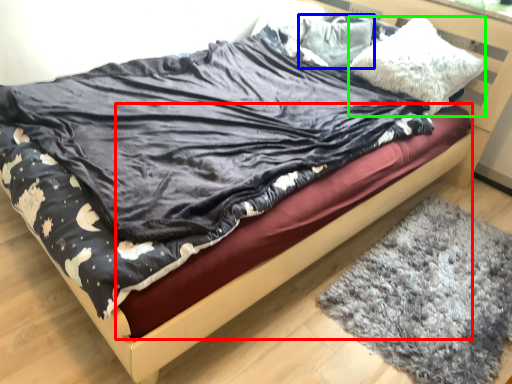
Question: Which is farther away from bed frame (highlighted by a red box)? pillow (highlighted by a blue box) or pillow (highlighted by a green box)?

Choices:
 (A) pillow
 (B) pillow

Answer: (A)